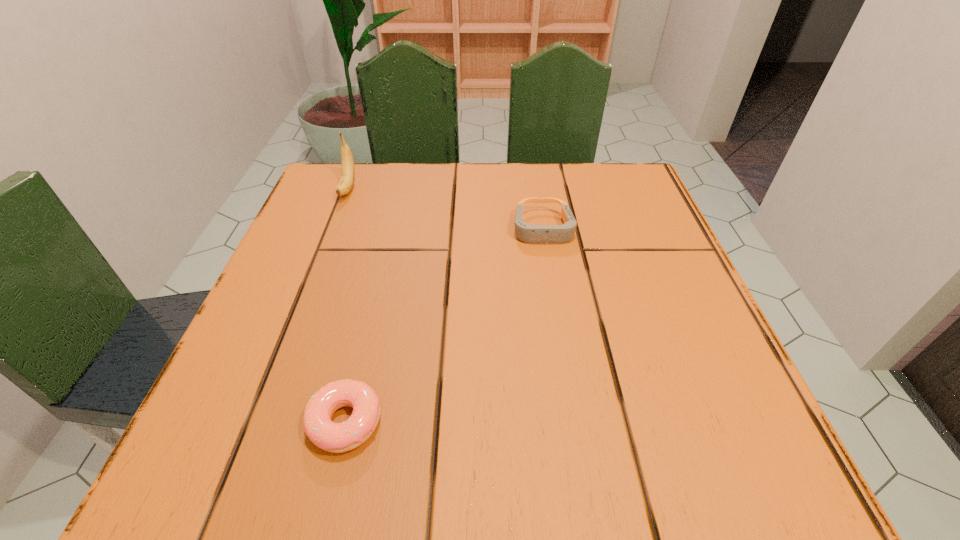
This screenshot has height=540, width=960. In order to click on free space at the far left corner of the desktop in this screenshot , I will do `click(379, 166)`.

The width and height of the screenshot is (960, 540). In the image, there is a desktop. What are the coordinates of `vacant space at the far right corner` in the screenshot? It's located at (600, 178).

The image size is (960, 540). I want to click on free spot between the goggles and the leftmost object, so click(x=445, y=208).

Find the location of a particular element. The width and height of the screenshot is (960, 540). free space between the second object from right to left and the second farthest object is located at coordinates (444, 325).

The height and width of the screenshot is (540, 960). I want to click on unoccupied position between the farthest object and the nearest object, so click(x=347, y=305).

The height and width of the screenshot is (540, 960). What are the coordinates of `empty space between the nearest object and the leftmost object` in the screenshot? It's located at (347, 305).

You are a GUI agent. You are given a task and a screenshot of the screen. Output one action in this format:
    pyautogui.click(x=<x>, y=<y>)
    Task: Click on the free space between the rightmost object and the leftmost object
    The image size is (960, 540).
    Given the screenshot: What is the action you would take?
    pyautogui.click(x=445, y=208)

Locate an element on the screen. free space between the goggles and the leftmost object is located at coordinates (445, 208).

This screenshot has width=960, height=540. I want to click on vacant point located between the farthest object and the goggles, so click(x=445, y=208).

This screenshot has height=540, width=960. Find the location of `vacant space that is in between the goggles and the leftmost object`. vacant space that is in between the goggles and the leftmost object is located at coordinates (445, 208).